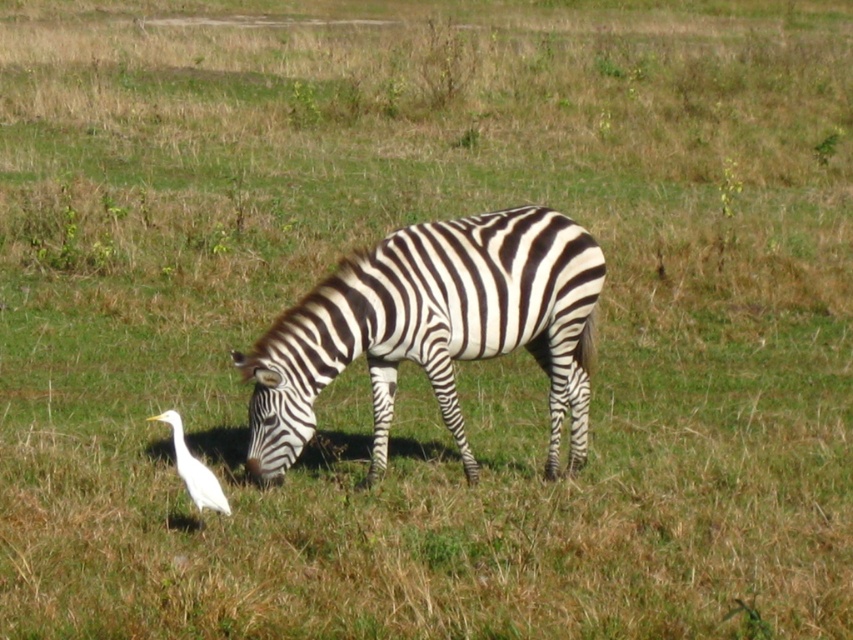
Who is more distant from viewer, [265,456] or [204,490]?

Point [265,456]

Is black and white striped zebra at center to the left of white matte bird at lower left from the viewer's perspective?

Incorrect, black and white striped zebra at center is not on the left side of white matte bird at lower left.

The width and height of the screenshot is (853, 640). What do you see at coordinates (432, 328) in the screenshot? I see `black and white striped zebra at center` at bounding box center [432, 328].

The image size is (853, 640). I want to click on black and white striped zebra at center, so click(432, 328).